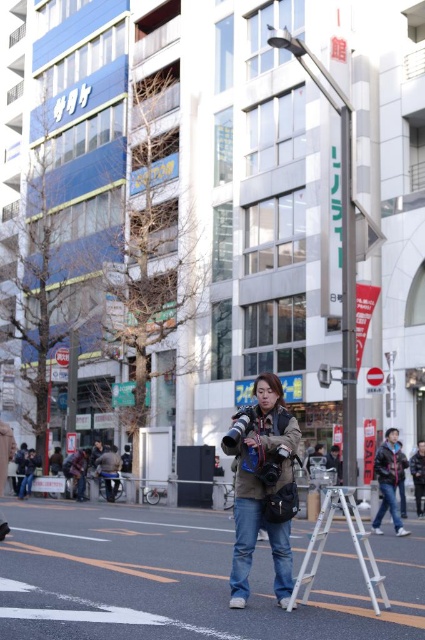
You are standing in the urban street scene and want to take a photo of the silver metallic ladder at center without the dark blue jacket at center appearing in the frame. Which direction should you move to achieve this?

The silver metallic ladder at center is to the left of dark blue jacket at center. To avoid the dark blue jacket at center in the frame, move to the right side of the ladder so that the jacket is out of the shot.

You are a photographer trying to decide which jacket to wear for an outdoor shoot. You have the denim jacket at center and the dark blue jacket at center. If you want to choose the smaller one, which jacket should you pick?

The denim jacket at center is smaller than the dark blue jacket at center, so you should choose the denim jacket at center.